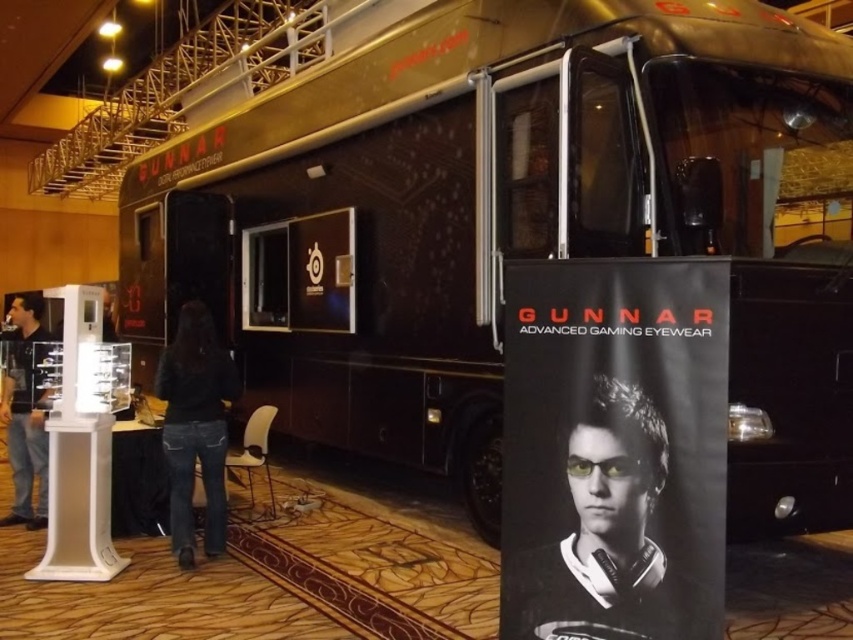
Based on the photo, you are a photographer standing at the location of the dark blue jeans at lower center. You want to take a photo of the matte black poster at center without moving your position. Is the poster within your camera lens range if the maximum distance your camera can focus is 10 feet?

The distance between the matte black poster at center and dark blue jeans at lower center is 8.91 feet, which is less than the camera lens range of 10 feet. Therefore, the photographer can take the photo without moving.

You are a delivery person standing at the entrance of the parking lot. You need to place a box that is 12 feet long between the matte black poster at center and the dark blue jeans at left. Is there enough space to place the box without overlapping either object?

The distance between the matte black poster at center and the dark blue jeans at left is 13.23 feet. Since the box is 12 feet long, there is enough space to place it between them without overlapping either object.